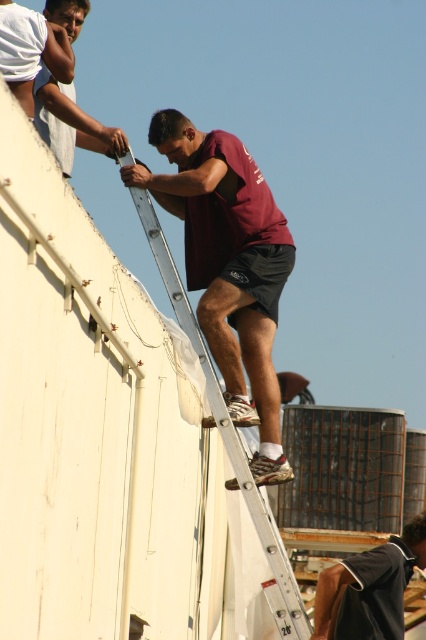
Question: Which object is positioned farthest from the dark blue jersey at upper center?

Choices:
 (A) matte white shirt at upper left
 (B) silver metallic ladder at upper center

Answer: (A)

Question: Does dark blue jersey at upper center appear on the right side of matte white shirt at upper left?

Choices:
 (A) yes
 (B) no

Answer: (A)

Question: Which object appears closest to the camera in this image?

Choices:
 (A) matte white shirt at upper left
 (B) silver metallic ladder at upper center

Answer: (A)

Question: Does dark blue jersey at upper center have a greater width compared to matte white shirt at upper left?

Choices:
 (A) no
 (B) yes

Answer: (B)

Question: Based on their relative distances, which object is nearer to the dark blue jersey at upper center?

Choices:
 (A) matte white shirt at upper left
 (B) silver metallic ladder at upper center

Answer: (B)

Question: From the image, what is the correct spatial relationship of silver metallic ladder at upper center in relation to matte white shirt at upper left?

Choices:
 (A) above
 (B) below

Answer: (B)